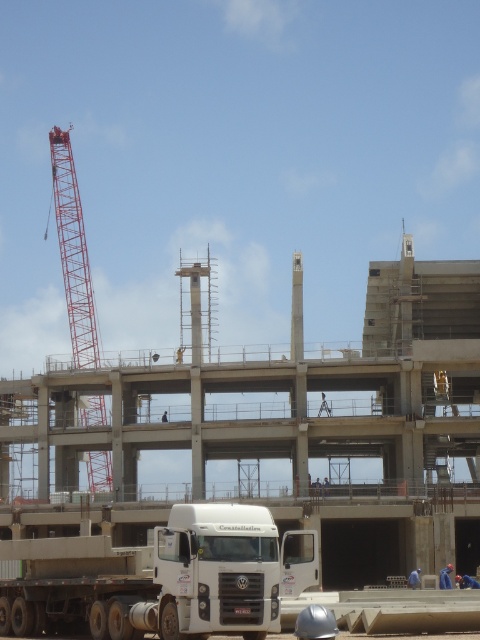
Is point (192, 419) behind point (33, 580)?

Yes, point (192, 419) is behind point (33, 580).

Does concrete at center lie in front of white matte truck at lower center?

No, concrete at center is further to the viewer.

Describe the element at coordinates (252, 416) in the screenshot. I see `concrete at center` at that location.

Where is `concrete at center`? The height and width of the screenshot is (640, 480). concrete at center is located at coordinates (252, 416).

Which is below, red metal crane at left or blue fabric construction worker at lower right?

blue fabric construction worker at lower right

Is red metal crane at left positioned in front of blue fabric construction worker at lower right?

No, red metal crane at left is further to the viewer.

You are a GUI agent. You are given a task and a screenshot of the screen. Output one action in this format:
    pyautogui.click(x=<x>, y=<y>)
    Task: Click on the red metal crane at left
    This screenshot has height=640, width=480.
    Given the screenshot: What is the action you would take?
    pyautogui.click(x=72, y=252)

Which is above, white matte truck at lower center or blue fabric construction worker at lower right?

white matte truck at lower center is above.

Measure the distance between point (192,540) and camera.

They are 53.34 meters apart.

Describe the element at coordinates (164, 577) in the screenshot. This screenshot has width=480, height=640. I see `white matte truck at lower center` at that location.

This screenshot has width=480, height=640. Identify the location of white matte truck at lower center. (164, 577).